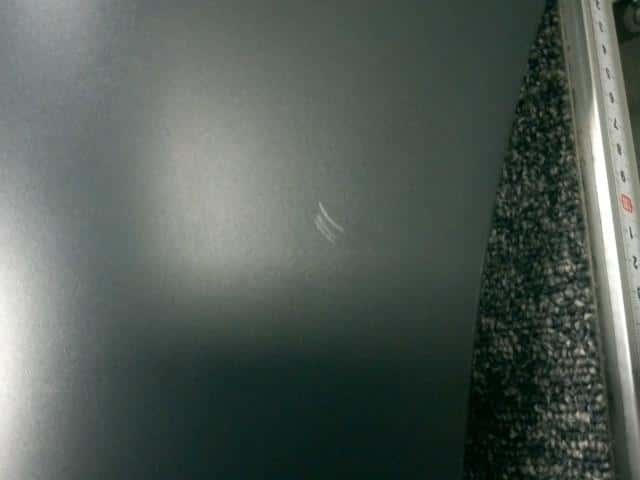
At what (x,y) coordinates should I click in order to perform the action: click on light. Please return your answer as a coordinate pair (x, y). The width and height of the screenshot is (640, 480). Looking at the image, I should click on (38, 306).